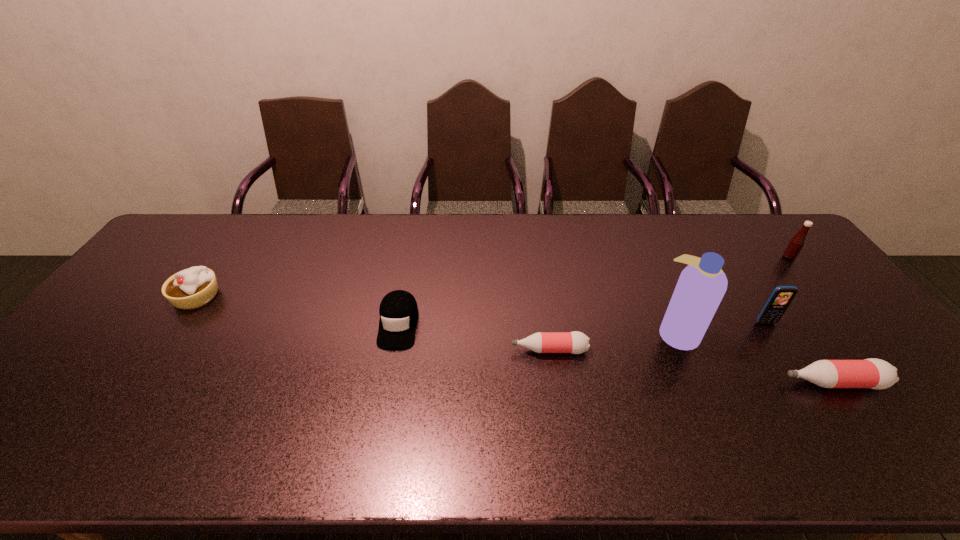
This screenshot has height=540, width=960. Identify the location of the farther bottle. pyautogui.click(x=575, y=342).

Find the location of a particular element. the left bottle is located at coordinates (575, 342).

You are a GUI agent. You are given a task and a screenshot of the screen. Output one action in this format:
    pyautogui.click(x=<x>, y=<y>)
    Task: Click on the right bottle
    Image resolution: width=960 pixels, height=540 pixels.
    Given the screenshot: What is the action you would take?
    pyautogui.click(x=872, y=373)

Identify the location of the taller bottle. The height and width of the screenshot is (540, 960). (872, 373).

The image size is (960, 540). Find the location of `the fourth tallest object`. the fourth tallest object is located at coordinates (191, 288).

This screenshot has width=960, height=540. What are the coordinates of `whipped cream` in the screenshot? It's located at (191, 288).

Image resolution: width=960 pixels, height=540 pixels. I want to click on Tabasco sauce, so click(x=796, y=244).

Locate an element on the screen. The width and height of the screenshot is (960, 540). the farthest object is located at coordinates (796, 244).

Locate an element on the screen. This screenshot has height=540, width=960. the fourth object from left to right is located at coordinates (702, 284).

Locate an element on the screen. The width and height of the screenshot is (960, 540). shampoo is located at coordinates (702, 284).